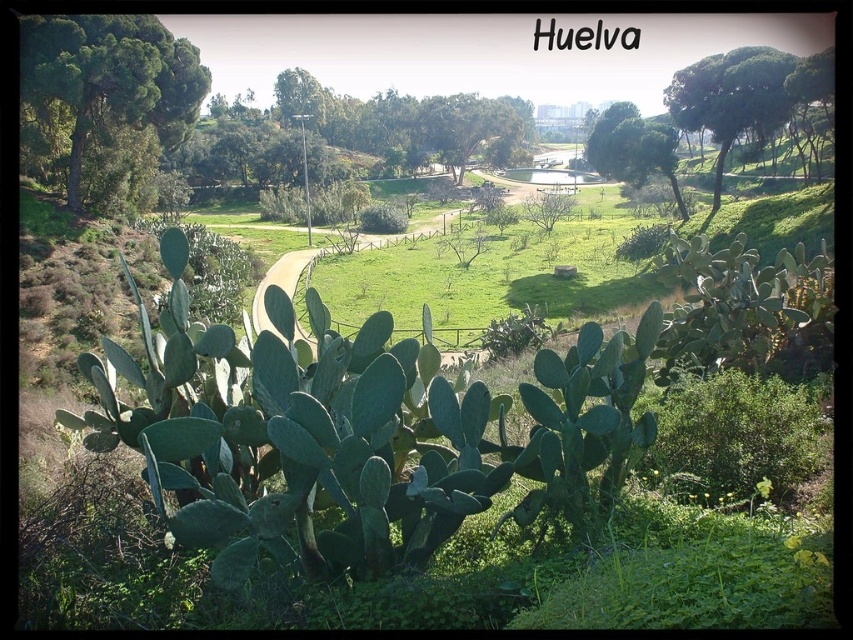
You are standing at the bottom of the hill in Huelva and see the green leafy tree at upper left and the green leafy tree at center. Which tree would you need to look up to more to see the top of?

The green leafy tree at center is taller than the green leafy tree at upper left, so you would need to look up more to see the top of the green leafy tree at center.